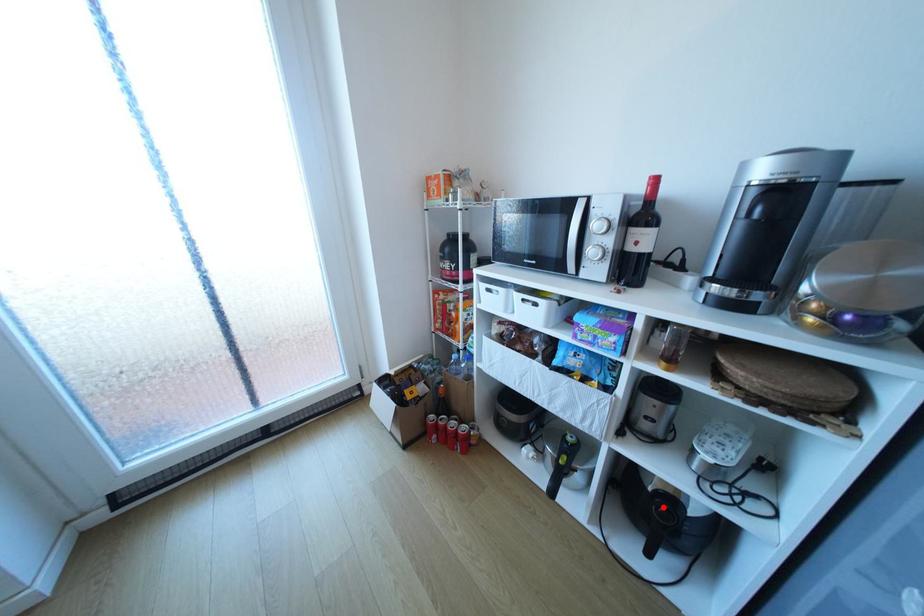
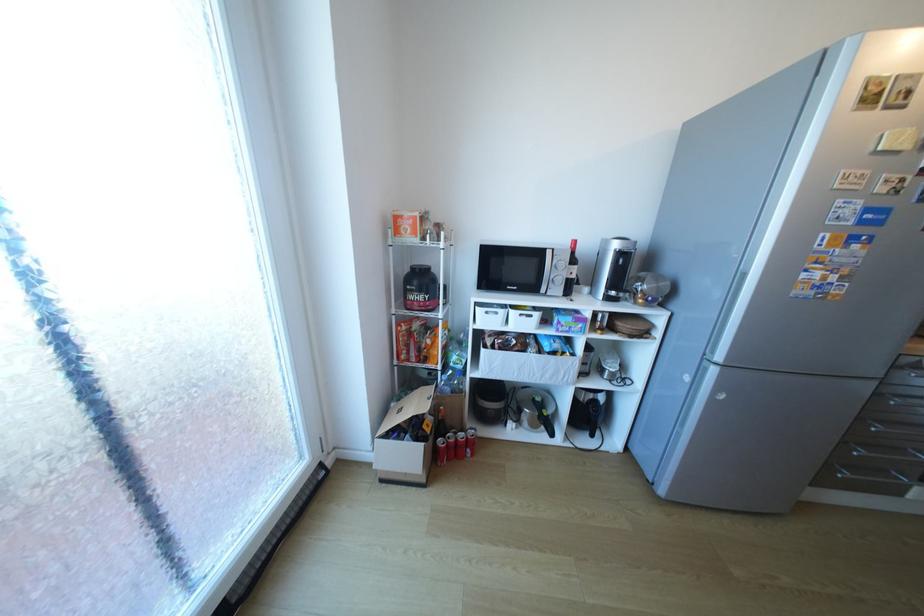
Question: I am providing you with two images of the same scene from different viewpoints. A red point is shown in image1. For the corresponding object point in image2, is it positioned nearer or farther from the camera?

Choices:
 (A) Nearer
 (B) Farther

Answer: (B)